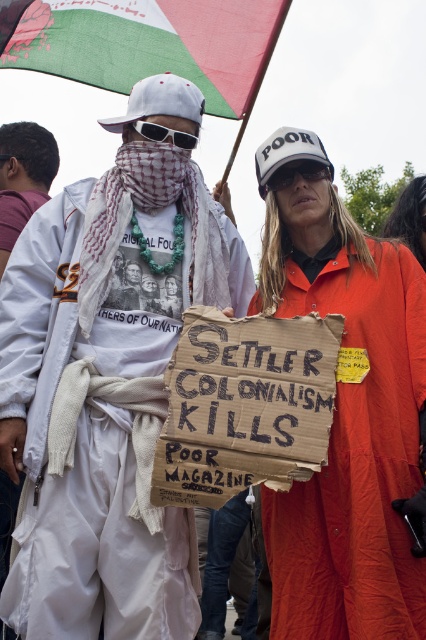
You are a photographer trying to capture a clear shot of the orange cotton robe at center and the black plastic sunglasses at center. Since the camera can only focus on one object at a time, which object should you choose to ensure it fills more of the frame?

The orange cotton robe at center has a larger size compared to the black plastic sunglasses at center, so you should focus on the orange cotton robe at center to fill more of the frame.

Based on the scene description, which object is taller between the white fabric scarf at left and the sunglassestransparent at upper center?

The white fabric scarf at left is much taller than the sunglassestransparent at upper center according to the description.